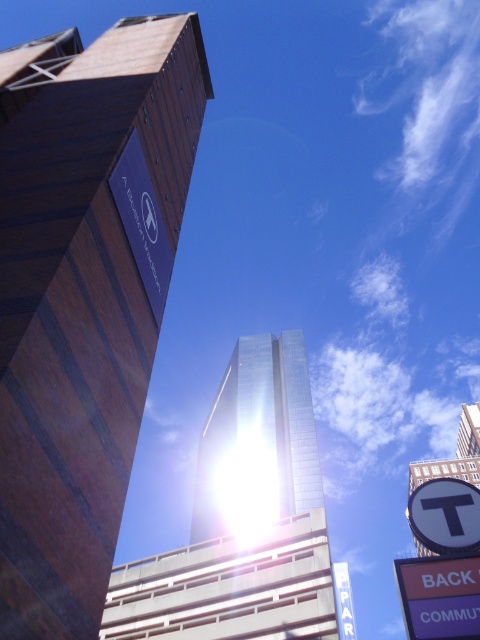
This screenshot has height=640, width=480. I want to click on glossy metallic skyscraper at center, so click(x=242, y=518).

Is glossy metallic skyscraper at center above white plastic sign at lower right?

No, glossy metallic skyscraper at center is not above white plastic sign at lower right.

At what (x,y) coordinates should I click in order to perform the action: click on glossy metallic skyscraper at center. Please return your answer as a coordinate pair (x, y). The image size is (480, 640). Looking at the image, I should click on (242, 518).

This screenshot has width=480, height=640. Find the location of `glossy metallic skyscraper at center`. glossy metallic skyscraper at center is located at coordinates (242, 518).

Is brown wood tower at upper left bigger than purple plastic sign at lower right?

Indeed, brown wood tower at upper left has a larger size compared to purple plastic sign at lower right.

Looking at this image, does brown wood tower at upper left have a lesser height compared to purple plastic sign at lower right?

No, brown wood tower at upper left is not shorter than purple plastic sign at lower right.

The height and width of the screenshot is (640, 480). Find the location of `brown wood tower at upper left`. brown wood tower at upper left is located at coordinates (85, 305).

In order to click on glossy metallic skyscraper at center in this screenshot , I will do `click(242, 518)`.

Does glossy metallic skyscraper at center come behind purple plastic sign at lower right?

Yes, glossy metallic skyscraper at center is behind purple plastic sign at lower right.

Between point (305, 586) and point (463, 580), which one is positioned in front?

Point (463, 580) is in front.

The height and width of the screenshot is (640, 480). Find the location of `glossy metallic skyscraper at center`. glossy metallic skyscraper at center is located at coordinates (242, 518).